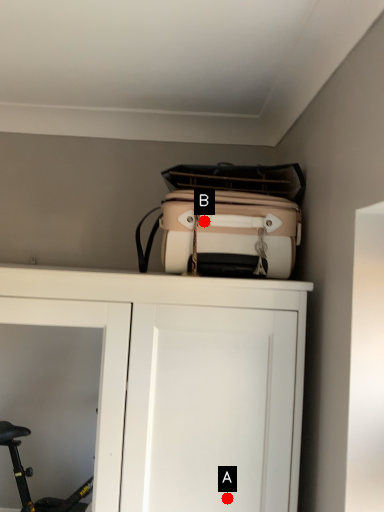
Question: Two points are circled on the image, labeled by A and B beside each circle. Which point is farther to the camera?

Choices:
 (A) A is further
 (B) B is further

Answer: (B)